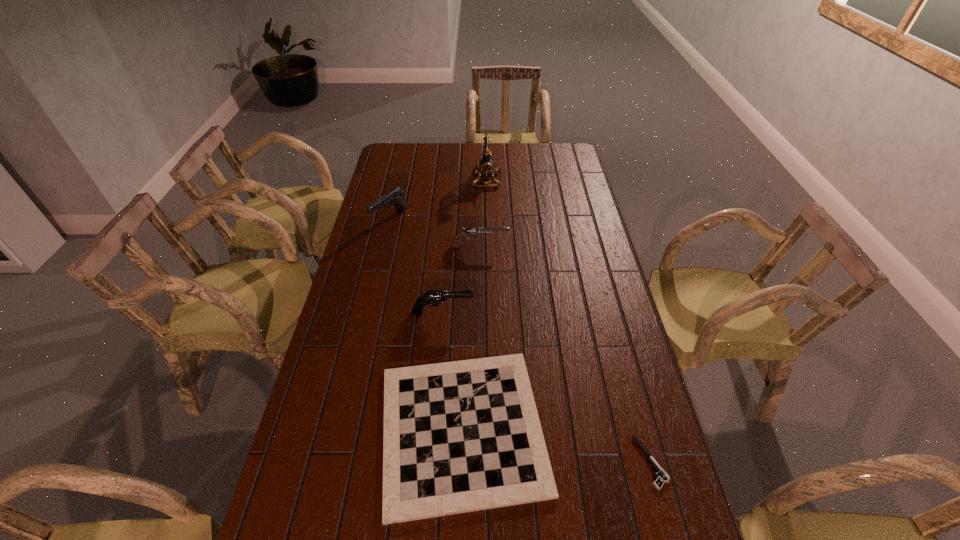
Locate an element on the screen. Image resolution: width=960 pixels, height=540 pixels. gun that is the nearest to the nearest gun is located at coordinates (470, 231).

Identify which gun is the second closest to the fifth nearest object. Please provide its 2D coordinates. Your answer should be formatted as a tuple, i.e. [(x, y)], where the tuple contains the x and y coordinates of a point satisfying the conditions above.

[(434, 297)]

You are a GUI agent. You are given a task and a screenshot of the screen. Output one action in this format:
    pyautogui.click(x=<x>, y=<y>)
    Task: Click on the free location that satisfies the following two spatial constraints: 1. on the front of the farthest object, featuring the rotary dial; 2. at the muzzle of the farthest gun
    Image resolution: width=960 pixels, height=540 pixels.
    Given the screenshot: What is the action you would take?
    pyautogui.click(x=488, y=220)

Image resolution: width=960 pixels, height=540 pixels. What are the coordinates of `free space that satisfies the following two spatial constraints: 1. on the front of the farthest object, featuring the rotary dial; 2. at the muzzle of the farthest gun` in the screenshot? It's located at (488, 220).

Where is `free location that satisfies the following two spatial constraints: 1. at the muzzle of the second shortest object; 2. on the right side of the fifth nearest object`? free location that satisfies the following two spatial constraints: 1. at the muzzle of the second shortest object; 2. on the right side of the fifth nearest object is located at coordinates (341, 429).

Locate an element on the screen. free point that satisfies the following two spatial constraints: 1. at the muzzle of the leftmost object; 2. on the left side of the checkerboard is located at coordinates (341, 429).

Find the location of a particular element. Image resolution: width=960 pixels, height=540 pixels. vacant space that satisfies the following two spatial constraints: 1. on the front of the telephone, featuring the rotary dial; 2. at the muzzle of the farthest gun is located at coordinates (488, 220).